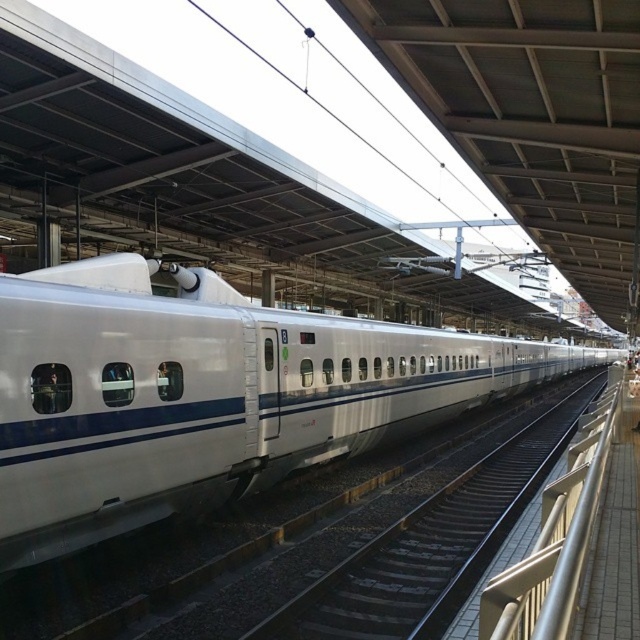
Who is lower down, white smooth train track at center or silver metallic rail at right?

white smooth train track at center is below.

Is white smooth train track at center shorter than silver metallic rail at right?

Indeed, white smooth train track at center has a lesser height compared to silver metallic rail at right.

The width and height of the screenshot is (640, 640). Identify the location of white smooth train track at center. (432, 545).

Is white glossy train at center further to the viewer compared to silver metallic rail at right?

That is True.

Is white glossy train at center wider than silver metallic rail at right?

Indeed, white glossy train at center has a greater width compared to silver metallic rail at right.

Who is more distant from viewer, (16, 460) or (596, 444)?

The point (596, 444) is behind.

At what (x,y) coordinates should I click in order to perform the action: click on white glossy train at center. Please return your answer as a coordinate pair (x, y). This screenshot has width=640, height=640. Looking at the image, I should click on (208, 396).

Can you confirm if white glossy train at center is taller than white smooth train track at center?

Correct, white glossy train at center is much taller as white smooth train track at center.

Where is `white glossy train at center`? white glossy train at center is located at coordinates (208, 396).

Who is more forward, (26, 442) or (353, 566)?

Positioned in front is point (26, 442).

Where is `white glossy train at center`? Image resolution: width=640 pixels, height=640 pixels. white glossy train at center is located at coordinates (208, 396).